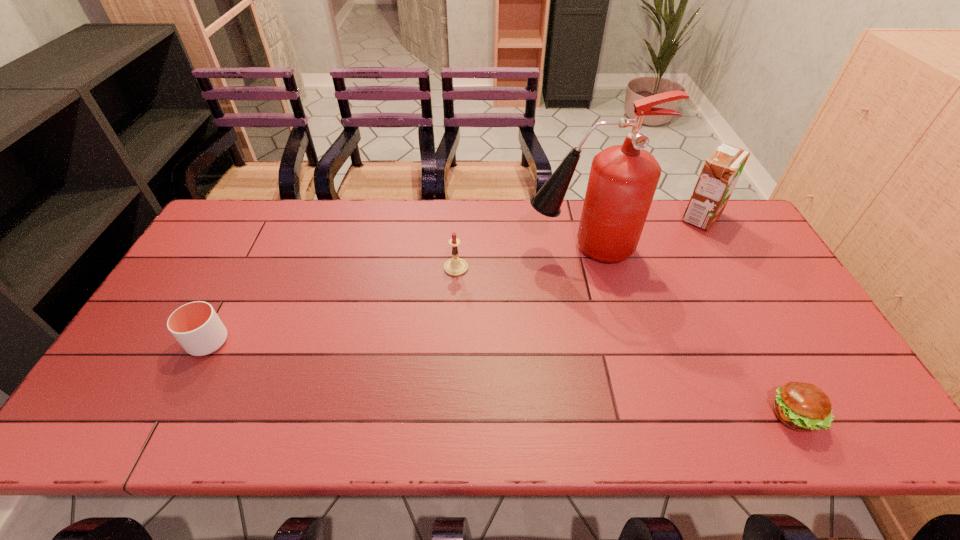
Where is `the third object from right to left`? The height and width of the screenshot is (540, 960). the third object from right to left is located at coordinates (623, 179).

This screenshot has width=960, height=540. I want to click on fire extinguisher, so click(623, 179).

Where is `carton`? Image resolution: width=960 pixels, height=540 pixels. carton is located at coordinates (722, 169).

Locate an element on the screen. The image size is (960, 540). candle is located at coordinates (454, 267).

Identify the location of the second object from left to right. (454, 267).

Identify the location of the leftmost object. Image resolution: width=960 pixels, height=540 pixels. (196, 326).

This screenshot has width=960, height=540. Identify the location of cup. (196, 326).

I want to click on the shortest object, so tap(800, 406).

What are the coordinates of `hamburger` in the screenshot? It's located at (800, 406).

Identify the location of blank space located with the nozzle aimed from the tallest object. The width and height of the screenshot is (960, 540). (456, 248).